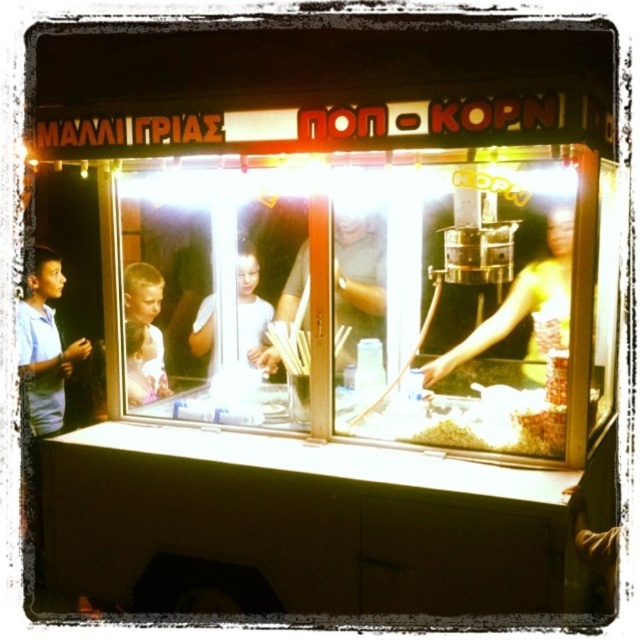
Based on the photo, which is above, white matte paper at center or white glossy shirt at center?

white matte paper at center is higher up.

Is point (365, 292) positioned before point (189, 336)?

Yes, point (365, 292) is in front of point (189, 336).

Identify the location of white matte paper at center. The height and width of the screenshot is (640, 640). (358, 275).